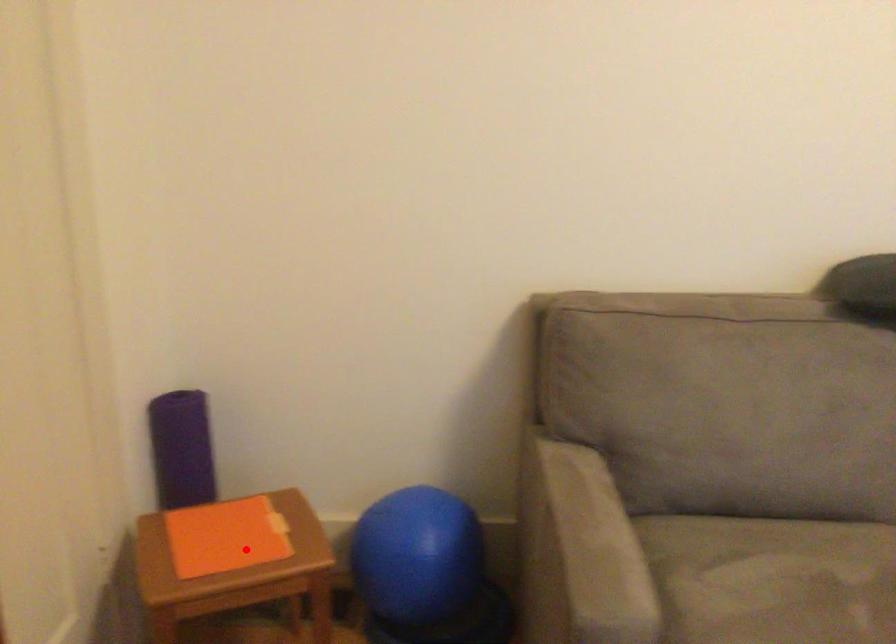
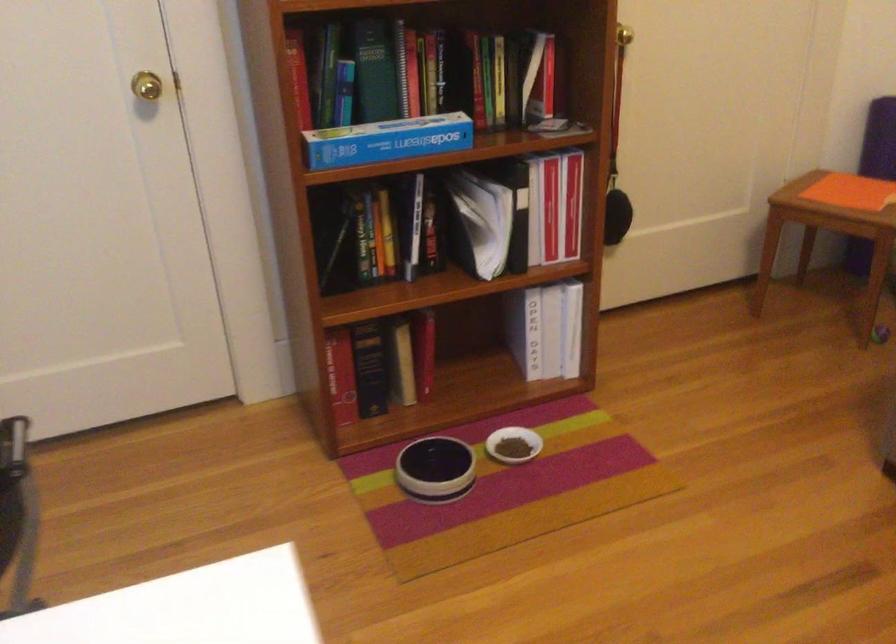
Question: I am providing you with two images of the same scene from different viewpoints. In image1, a red point is highlighted. Considering the same 3D point in image2, which of the following is correct?

Choices:
 (A) It is closer
 (B) It is farther

Answer: (B)